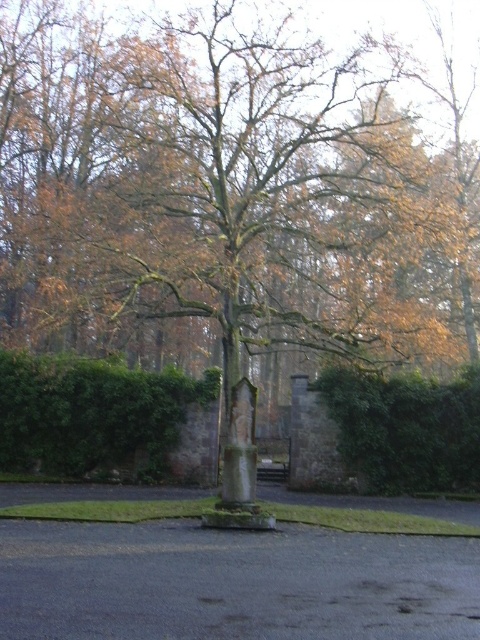
Who is shorter, green leafy hedge at center or green leafy hedge at right?

Standing shorter between the two is green leafy hedge at center.

Can you confirm if green leafy hedge at center is positioned to the right of green leafy hedge at right?

Incorrect, green leafy hedge at center is not on the right side of green leafy hedge at right.

Is point (92, 464) more distant than point (447, 381)?

That is False.

Identify the location of green leafy hedge at center. The width and height of the screenshot is (480, 640). (93, 417).